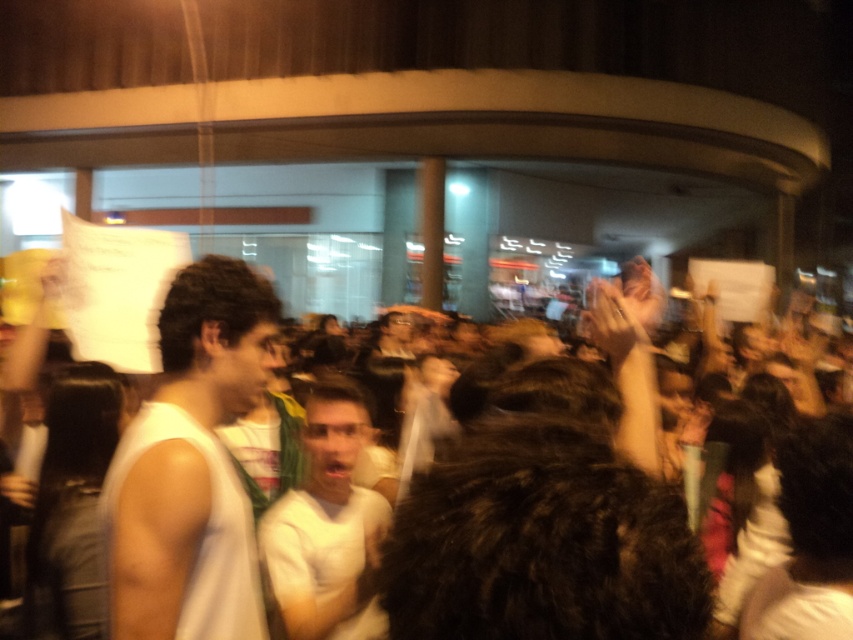
Is white fur coat at center positioned at the back of white fabric shirt at center?

Yes, white fur coat at center is behind white fabric shirt at center.

Who is taller, white fur coat at center or white fabric shirt at center?

white fur coat at center is taller.

Between point (614, 454) and point (195, 516), which one is positioned behind?

Point (195, 516)

In order to click on white fur coat at center in this screenshot , I will do `click(163, 548)`.

Which is behind, point (529, 636) or point (310, 422)?

The point (310, 422) is more distant.

Consider the image. Who is shorter, white fur coat at center or white matte shirt at center?

Standing shorter between the two is white matte shirt at center.

You are a GUI agent. You are given a task and a screenshot of the screen. Output one action in this format:
    pyautogui.click(x=<x>, y=<y>)
    Task: Click on the white fur coat at center
    This screenshot has width=853, height=640.
    Given the screenshot: What is the action you would take?
    pyautogui.click(x=163, y=548)

Is white fabric shirt at center taller than white matte shirt at center?

Correct, white fabric shirt at center is much taller as white matte shirt at center.

Is white fabric shirt at center further to camera compared to white matte shirt at center?

No, white fabric shirt at center is closer to the viewer.

Is point (213, 486) positioned before point (367, 556)?

That is True.

Where is `white fabric shirt at center`? This screenshot has width=853, height=640. white fabric shirt at center is located at coordinates (192, 467).